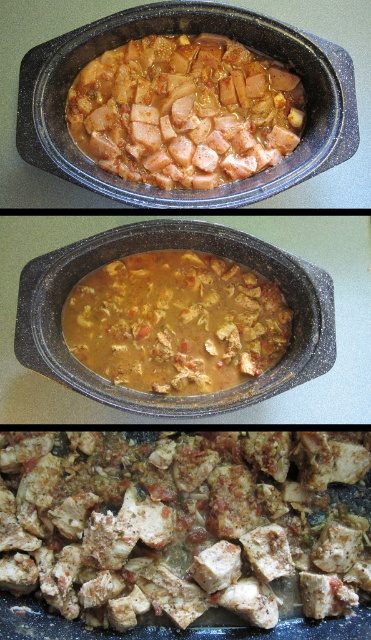
Looking at the top image of the collage, you see a slow cooker with brown matte diced meat at center and brown matte stew at center. Which one has a greater width?

The brown matte diced meat at center has a greater width than the brown matte stew at center.

What is the position of the brown matte sausage at center in the top image of the collage?

The brown matte sausage at center is located at point 0.175 on the x axis and 0.499 on the y axis in the top image of the collage.